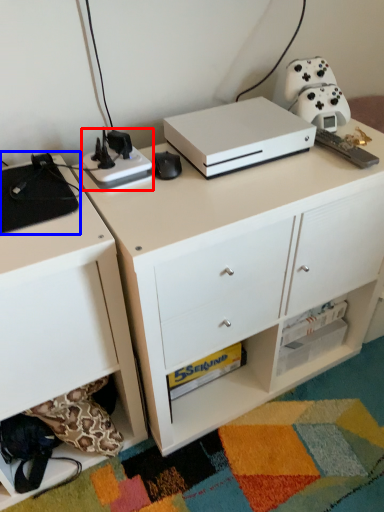
Question: Which object is closer to the camera taking this photo, appliance (highlighted by a red box) or appliance (highlighted by a blue box)?

Choices:
 (A) appliance
 (B) appliance

Answer: (B)